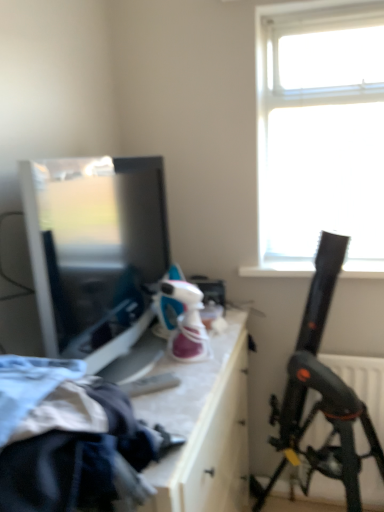
Question: Considering the relative positions of matte black television at left and black plastic telescope at right in the image provided, is matte black television at left in front of black plastic telescope at right?

Choices:
 (A) yes
 (B) no

Answer: (A)

Question: Is matte black television at left taller than black plastic telescope at right?

Choices:
 (A) yes
 (B) no

Answer: (B)

Question: From the image's perspective, is matte black television at left under black plastic telescope at right?

Choices:
 (A) yes
 (B) no

Answer: (B)

Question: From a real-world perspective, is matte black television at left beneath black plastic telescope at right?

Choices:
 (A) yes
 (B) no

Answer: (B)

Question: Could black plastic telescope at right be considered to be inside matte black television at left?

Choices:
 (A) yes
 (B) no

Answer: (B)

Question: Is black plastic telescope at right inside or outside of white glossy drawer at center?

Choices:
 (A) outside
 (B) inside

Answer: (A)

Question: From a real-world perspective, is black plastic telescope at right physically located above or below white glossy drawer at center?

Choices:
 (A) below
 (B) above

Answer: (B)

Question: Looking at their shapes, would you say black plastic telescope at right is wider or thinner than white glossy drawer at center?

Choices:
 (A) thin
 (B) wide

Answer: (A)

Question: From the image's perspective, is black plastic telescope at right positioned above or below white glossy drawer at center?

Choices:
 (A) above
 (B) below

Answer: (A)

Question: From a real-world perspective, is matte black television at left positioned above or below white glossy drawer at center?

Choices:
 (A) below
 (B) above

Answer: (B)

Question: Which is correct: matte black television at left is inside white glossy drawer at center, or outside of it?

Choices:
 (A) inside
 (B) outside

Answer: (B)

Question: Is point (79, 286) positioned closer to the camera than point (208, 389)?

Choices:
 (A) closer
 (B) farther

Answer: (A)

Question: From the image's perspective, is matte black television at left located above or below white glossy drawer at center?

Choices:
 (A) below
 (B) above

Answer: (B)

Question: From a real-world perspective, is white glossy drawer at center above or below matte black television at left?

Choices:
 (A) above
 (B) below

Answer: (B)

Question: From the image's perspective, is white glossy drawer at center located above or below matte black television at left?

Choices:
 (A) above
 (B) below

Answer: (B)